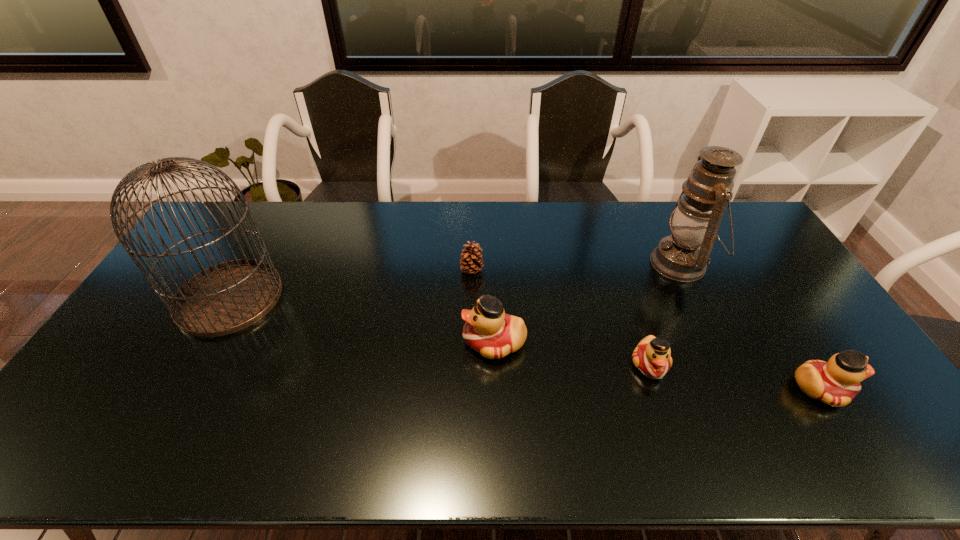
Identify the location of free point located 0.280m on the face of the leftmost duck. (364, 342).

Locate an element on the screen. free space located on the face of the leftmost duck is located at coordinates (332, 342).

Find the location of a particular element. This screenshot has width=960, height=540. vacant position located on the face of the shortest duck is located at coordinates (662, 400).

Find the location of a particular element. This screenshot has width=960, height=540. vacant space located 0.050m on the face of the rightmost object is located at coordinates (869, 388).

Locate an element on the screen. Image resolution: width=960 pixels, height=540 pixels. vacant space located on the right of the birdcage is located at coordinates (379, 298).

At what (x,y) coordinates should I click in order to perform the action: click on free region located 0.240m on the right of the pinecone. Please return your answer as a coordinate pair (x, y). Looking at the image, I should click on (556, 271).

Find the location of a particular element. This screenshot has height=540, width=960. vacant point located 0.050m on the front of the oil lamp is located at coordinates (701, 305).

You are a GUI agent. You are given a task and a screenshot of the screen. Output one action in this format:
    pyautogui.click(x=<x>, y=<y>)
    Task: Click on the object present at the far edge
    The width and height of the screenshot is (960, 540).
    Given the screenshot: What is the action you would take?
    (683, 256)

At what (x,y) coordinates should I click in order to perform the action: click on object that is at the near edge. Please return your answer as a coordinate pair (x, y). This screenshot has height=540, width=960. Looking at the image, I should click on (836, 382).

At what (x,y) coordinates should I click in order to perform the action: click on object that is at the left edge. Please return your answer as a coordinate pair (x, y). Looking at the image, I should click on (228, 297).